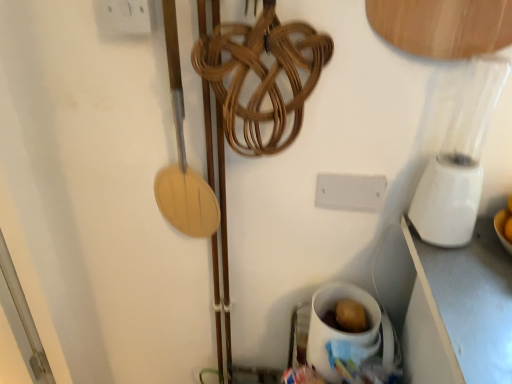
Question: Is white ceramic mug at lower right smaller than white plastic electric outlet at upper left?

Choices:
 (A) yes
 (B) no

Answer: (B)

Question: Is white plastic electric outlet at upper left at the back of white ceramic mug at lower right?

Choices:
 (A) yes
 (B) no

Answer: (B)

Question: Is the position of white ceramic mug at lower right more distant than that of white plastic electric outlet at upper left?

Choices:
 (A) yes
 (B) no

Answer: (A)

Question: Would you say white ceramic mug at lower right contains white plastic electric outlet at upper left?

Choices:
 (A) no
 (B) yes

Answer: (A)

Question: Considering the relative sizes of white ceramic mug at lower right and white plastic electric outlet at upper left in the image provided, is white ceramic mug at lower right wider than white plastic electric outlet at upper left?

Choices:
 (A) yes
 (B) no

Answer: (A)

Question: Is white ceramic mug at lower right outside of white plastic electric outlet at upper left?

Choices:
 (A) no
 (B) yes

Answer: (B)

Question: Is white plastic electric outlet at upper left outside of white ceramic mug at lower right?

Choices:
 (A) no
 (B) yes

Answer: (B)

Question: From the image's perspective, is white plastic electric outlet at upper left on top of white ceramic mug at lower right?

Choices:
 (A) yes
 (B) no

Answer: (A)

Question: Considering the relative sizes of white plastic electric outlet at upper left and white ceramic mug at lower right in the image provided, is white plastic electric outlet at upper left shorter than white ceramic mug at lower right?

Choices:
 (A) no
 (B) yes

Answer: (B)

Question: Are white plastic electric outlet at upper left and white ceramic mug at lower right beside each other?

Choices:
 (A) no
 (B) yes

Answer: (A)

Question: From a real-world perspective, is white plastic electric outlet at upper left below white ceramic mug at lower right?

Choices:
 (A) yes
 (B) no

Answer: (B)

Question: Is white plastic electric outlet at upper left wider than white ceramic mug at lower right?

Choices:
 (A) no
 (B) yes

Answer: (A)

Question: Considering the relative sizes of white plastic electric outlet at upper left and white plastic blender at right in the image provided, is white plastic electric outlet at upper left shorter than white plastic blender at right?

Choices:
 (A) no
 (B) yes

Answer: (B)